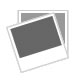
The width and height of the screenshot is (80, 80). Identify the location of light gray picture on back polaroid. click(24, 15).